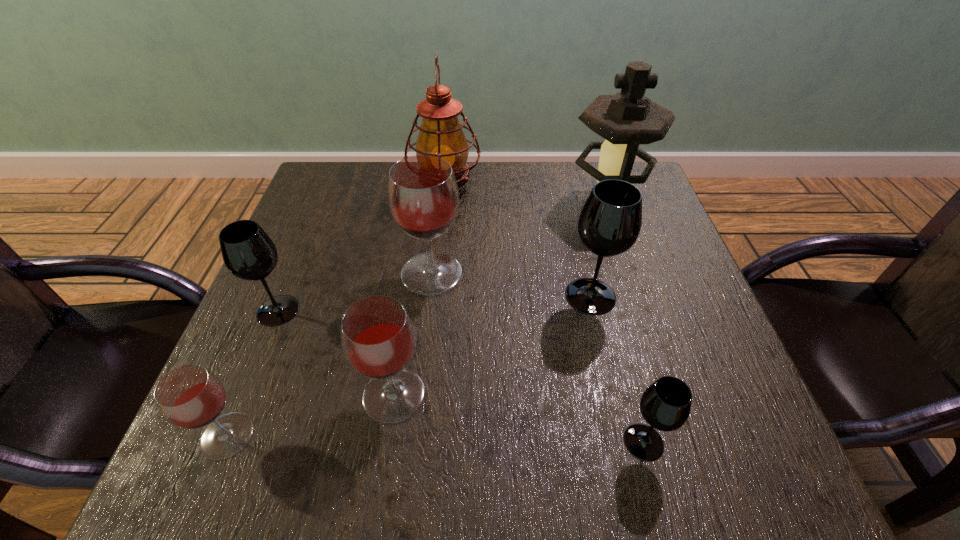
This screenshot has width=960, height=540. I want to click on free space located 0.150m on the back of the farthest red wineglass, so click(x=438, y=212).

You are a GUI agent. You are given a task and a screenshot of the screen. Output one action in this format:
    pyautogui.click(x=<x>, y=<y>)
    Task: Click on the free space located 0.090m on the right of the biggest gray wineglass
    
    Given the screenshot: What is the action you would take?
    pyautogui.click(x=660, y=296)

Image resolution: width=960 pixels, height=540 pixels. Identify the location of vacant space situated 0.120m on the back of the leftmost gray wineglass. (301, 254).

At what (x,y) coordinates should I click in order to perform the action: click on vacant space located 0.310m on the right of the second smallest red wineglass. Please return your answer as a coordinate pair (x, y). Image resolution: width=960 pixels, height=540 pixels. Looking at the image, I should click on (609, 395).

At what (x,y) coordinates should I click in order to perform the action: click on vacant area located 0.060m on the left of the smallest gray wineglass. Please return your answer as a coordinate pair (x, y). Looking at the image, I should click on (585, 442).

Identify the location of blank space located on the back of the smallest red wineglass. (297, 267).

You are a GUI agent. You are given a task and a screenshot of the screen. Output one action in this format:
    pyautogui.click(x=<x>, y=<y>)
    Task: Click on the oil lamp present at the right edge
    The width and height of the screenshot is (960, 540).
    Given the screenshot: What is the action you would take?
    pyautogui.click(x=627, y=119)

Identify the location of wineglass situated at the right edge. (665, 405).

Locate an element on the screen. object present at the near left corner is located at coordinates (190, 397).

Image resolution: width=960 pixels, height=540 pixels. What are the coordinates of `object at the far right corner` in the screenshot? It's located at (627, 119).